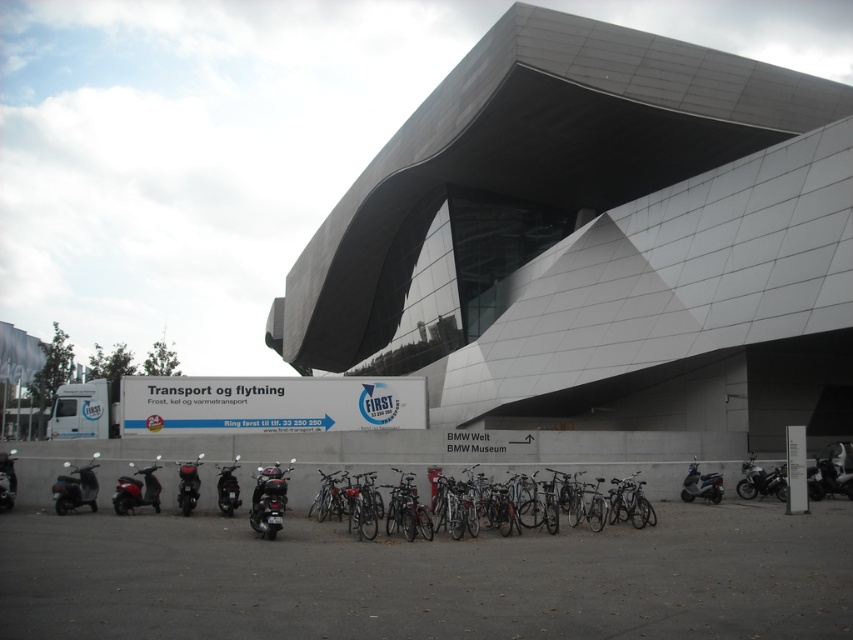
You are a delivery person who needs to park your silver metallic bicycle at center near the building entrance. Based on the image, can you confirm if the bicycle is already parked in the designated bike parking area?

The silver metallic bicycle at center is located at point (535,504), which is within the designated bike parking area marked by the row of bicycles in front of the building.

You are a delivery person who needs to park your scooter in the parking area near the modern building. You have a scooter that is 1.5 meters long. There is a space between the metallic silver scooter at lower left and the matte black scooter at lower left. Can your scooter fit in that space?

The distance between the metallic silver scooter at lower left and the matte black scooter at lower left is 1.22 meters. Since your scooter is 1.5 meters long, it cannot fit in the space between them.